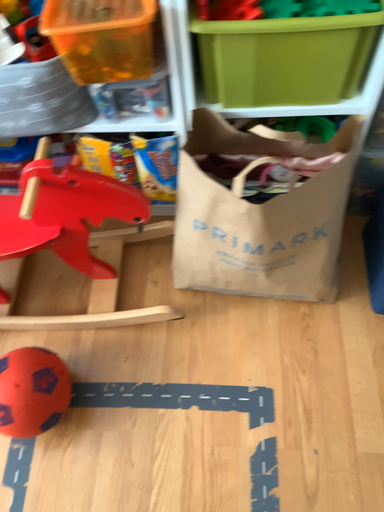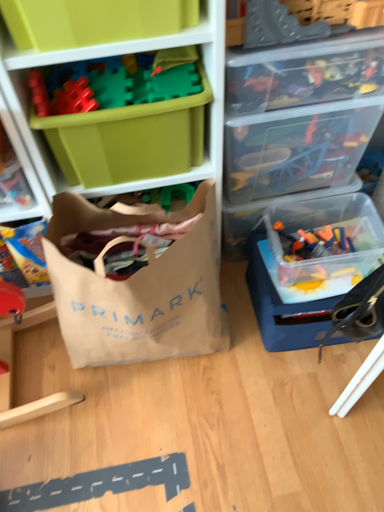
Question: How did the camera likely rotate when shooting the video?

Choices:
 (A) rotated right
 (B) rotated left

Answer: (A)